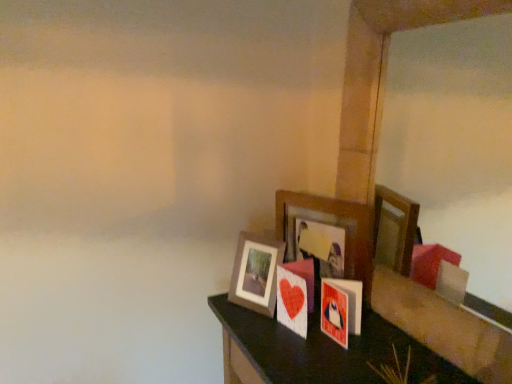
Question: Which direction should I rotate to look at wooden picture frame at center, acting as the 2th picture frame starting from the left?

Choices:
 (A) right
 (B) left

Answer: (A)

Question: Is wooden picture frame at center, the first picture frame viewed from the right, positioned with its back to wooden photo frame at center, the first picture frame in the left-to-right sequence?

Choices:
 (A) no
 (B) yes

Answer: (A)

Question: Is wooden picture frame at center, the first picture frame viewed from the right, aimed at wooden photo frame at center, the 2th picture frame positioned from the right?

Choices:
 (A) yes
 (B) no

Answer: (A)

Question: Does wooden picture frame at center, the first picture frame viewed from the right, have a smaller size compared to wooden photo frame at center, the 2th picture frame positioned from the right?

Choices:
 (A) no
 (B) yes

Answer: (A)

Question: From a real-world perspective, does wooden picture frame at center, acting as the 2th picture frame starting from the left, sit lower than wooden photo frame at center, the 2th picture frame positioned from the right?

Choices:
 (A) yes
 (B) no

Answer: (B)

Question: From a real-world perspective, does wooden picture frame at center, acting as the 2th picture frame starting from the left, stand above wooden photo frame at center, the 2th picture frame positioned from the right?

Choices:
 (A) no
 (B) yes

Answer: (B)

Question: Would you say wooden photo frame at center, the first picture frame in the left-to-right sequence, is part of wooden picture frame at center, the first picture frame viewed from the right,'s contents?

Choices:
 (A) no
 (B) yes

Answer: (A)

Question: Considering the relative sizes of wooden photo frame at center, the first picture frame in the left-to-right sequence, and wooden picture frame at center, acting as the 2th picture frame starting from the left, in the image provided, is wooden photo frame at center, the first picture frame in the left-to-right sequence, bigger than wooden picture frame at center, acting as the 2th picture frame starting from the left,?

Choices:
 (A) no
 (B) yes

Answer: (A)

Question: Is wooden photo frame at center, the first picture frame in the left-to-right sequence, turned away from wooden picture frame at center, the first picture frame viewed from the right?

Choices:
 (A) no
 (B) yes

Answer: (B)

Question: Considering the relative sizes of wooden photo frame at center, the first picture frame in the left-to-right sequence, and wooden picture frame at center, the first picture frame viewed from the right, in the image provided, is wooden photo frame at center, the first picture frame in the left-to-right sequence, thinner than wooden picture frame at center, the first picture frame viewed from the right,?

Choices:
 (A) no
 (B) yes

Answer: (A)

Question: From the image's perspective, is wooden photo frame at center, the 2th picture frame positioned from the right, located beneath wooden picture frame at center, the first picture frame viewed from the right?

Choices:
 (A) yes
 (B) no

Answer: (A)

Question: Would you say wooden photo frame at center, the 2th picture frame positioned from the right, is outside wooden picture frame at center, the first picture frame viewed from the right?

Choices:
 (A) no
 (B) yes

Answer: (B)

Question: Does wooden photo frame at center, the 2th picture frame positioned from the right, come in front of wooden picture frame at center, acting as the 2th picture frame starting from the left?

Choices:
 (A) no
 (B) yes

Answer: (A)

Question: Considering the positions of wooden picture frame at center, the first picture frame viewed from the right, and wooden photo frame at center, the 2th picture frame positioned from the right, in the image, is wooden picture frame at center, the first picture frame viewed from the right, bigger or smaller than wooden photo frame at center, the 2th picture frame positioned from the right,?

Choices:
 (A) small
 (B) big

Answer: (B)